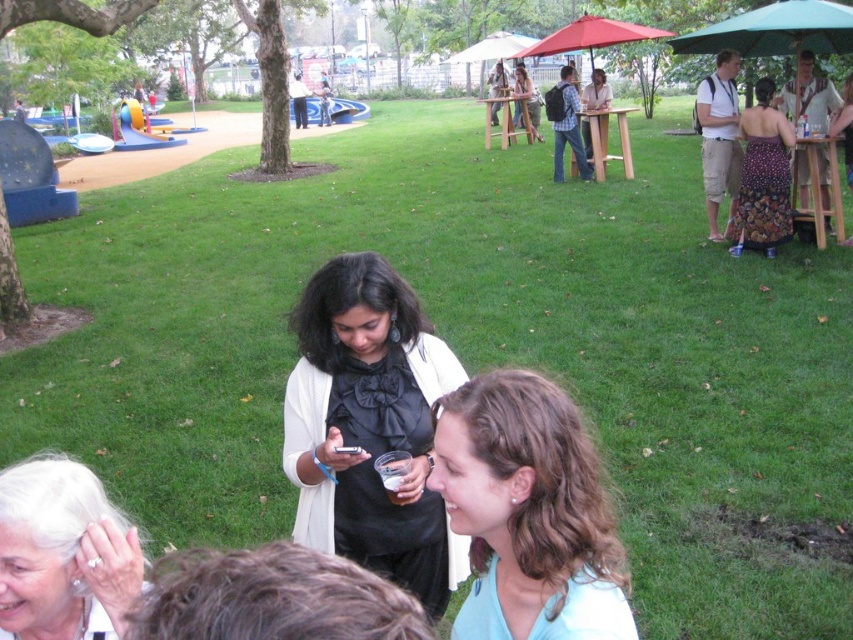
Based on the photo, you are standing in the park and want to take a photo of both the point at (535, 508) and the point at (109, 595). Which point should you focus on first to ensure both are in clear view?

You should focus on the point at (535, 508) first because it is closer to the camera than the point at (109, 595). This ensures both points will be in focus as the camera adjusts for the distance.

Please look at the image and tell me what object is located at the coordinates point (763, 176)?

The floral dress at right is located at point (763, 176).

You are a photographer at the park event and want to take a photo that includes both the light blue fabric at center and the white pearl earring at lower left. Which object should you focus on first to ensure both are in sharp focus?

The light blue fabric at center is further to the viewer than the white pearl earring at lower left. To ensure both are in sharp focus, focus on the light blue fabric at center first as it is closer to the camera, allowing the earring to fall within the depth of field.